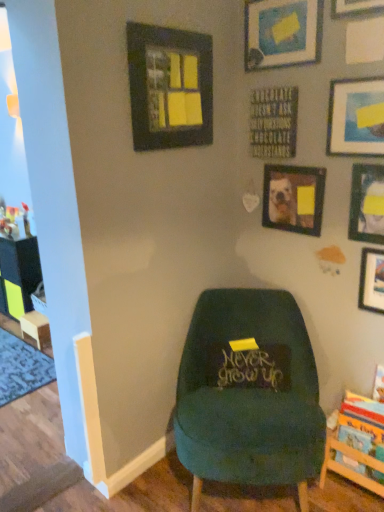
Describe the element at coordinates (282, 33) in the screenshot. This screenshot has width=384, height=512. I see `matte black picture frame at upper center, the second picture frame from the left` at that location.

The image size is (384, 512). What do you see at coordinates (293, 198) in the screenshot? I see `wooden picture frame at center, which is the fifth picture frame from right to left` at bounding box center [293, 198].

Locate an element on the screen. wooden at left is located at coordinates (35, 327).

The image size is (384, 512). What do you see at coordinates (169, 87) in the screenshot?
I see `matte black picture frame at upper left, which is counted as the 1th picture frame, starting from the left` at bounding box center [169, 87].

You are a GUI agent. You are given a task and a screenshot of the screen. Output one action in this format:
    pyautogui.click(x=<x>, y=<y>)
    Task: Click on the wooden bookshelf at lower right
    This screenshot has width=384, height=512.
    Given the screenshot: What is the action you would take?
    pyautogui.click(x=357, y=444)

Describe the element at coordinates (367, 204) in the screenshot. I see `matte black picture frame at upper right, the 2th picture frame in the right-to-left sequence` at that location.

The image size is (384, 512). Describe the element at coordinates (355, 7) in the screenshot. I see `wooden picture frame at upper right, the fourth picture frame when ordered from right to left` at that location.

At what (x,y) coordinates should I click in order to perform the action: click on matte black picture frame at upper center, the second picture frame from the left. Please return your answer as a coordinate pair (x, y). This screenshot has width=384, height=512. Looking at the image, I should click on (282, 33).

Looking at this image, is wooden at left facing towards velvet green chair at center?

No.

Is wooden at left not close to velvet green chair at center?

That's right, there is a large distance between wooden at left and velvet green chair at center.

How much distance is there between wooden at left and velvet green chair at center?

The distance of wooden at left from velvet green chair at center is 5.67 feet.

Which of these two, wooden at left or velvet green chair at center, stands shorter?

Standing shorter between the two is wooden at left.

Does matte blue picture frame at upper right, the 5th picture frame viewed from the left, lie behind wooden at left?

No, it is in front of wooden at left.

At what (x,y) coordinates should I click in order to perform the action: click on table below the matte blue picture frame at upper right, the 5th picture frame viewed from the left (from the image's perspective). Please return your answer as a coordinate pair (x, y). Image resolution: width=384 pixels, height=512 pixels. Looking at the image, I should click on (35, 327).

Can you tell me how much matte blue picture frame at upper right, the 5th picture frame viewed from the left, and wooden at left differ in facing direction?

The facing directions of matte blue picture frame at upper right, the 5th picture frame viewed from the left, and wooden at left are 0.902 degrees apart.

Considering the sizes of matte blue picture frame at upper right, the 5th picture frame viewed from the left, and wooden at left in the image, is matte blue picture frame at upper right, the 5th picture frame viewed from the left, wider or thinner than wooden at left?

matte blue picture frame at upper right, the 5th picture frame viewed from the left, is thinner than wooden at left.

Is matte black picture frame at upper center, the second picture frame from the left, looking in the opposite direction of wooden bookshelf at lower right?

matte black picture frame at upper center, the second picture frame from the left, is not turned away from wooden bookshelf at lower right.

From the image's perspective, is matte black picture frame at upper center, marked as the sixth picture frame in a right-to-left arrangement, located above or below wooden bookshelf at lower right?

From the image's perspective, matte black picture frame at upper center, marked as the sixth picture frame in a right-to-left arrangement, appears above wooden bookshelf at lower right.

From a real-world perspective, is matte black picture frame at upper center, marked as the sixth picture frame in a right-to-left arrangement, on wooden bookshelf at lower right?

Yes, from a real-world perspective, matte black picture frame at upper center, marked as the sixth picture frame in a right-to-left arrangement, is on top of wooden bookshelf at lower right.

Which of these two, matte black picture frame at upper center, the second picture frame from the left, or wooden bookshelf at lower right, is wider?

wooden bookshelf at lower right is wider.

Considering the positions of objects matte black picture frame at upper right, the 2th picture frame in the right-to-left sequence, and wooden bookshelf at lower right in the image provided, who is more to the left, matte black picture frame at upper right, the 2th picture frame in the right-to-left sequence, or wooden bookshelf at lower right?

wooden bookshelf at lower right is more to the left.

Who is smaller, matte black picture frame at upper right, the 6th picture frame in the left-to-right sequence, or wooden bookshelf at lower right?

matte black picture frame at upper right, the 6th picture frame in the left-to-right sequence.

Between matte black picture frame at upper right, the 2th picture frame in the right-to-left sequence, and wooden bookshelf at lower right, which one has more height?

With more height is wooden bookshelf at lower right.

Based on the photo, does matte black picture frame at upper right, the 6th picture frame in the left-to-right sequence, have a lesser width compared to matte black picture frame at upper center, marked as the sixth picture frame in a right-to-left arrangement?

Yes, matte black picture frame at upper right, the 6th picture frame in the left-to-right sequence, is thinner than matte black picture frame at upper center, marked as the sixth picture frame in a right-to-left arrangement.

Is matte black picture frame at upper right, the 2th picture frame in the right-to-left sequence, behind matte black picture frame at upper center, the second picture frame from the left?

No.

Is matte black picture frame at upper right, the 2th picture frame in the right-to-left sequence, completely or partially outside of matte black picture frame at upper center, marked as the sixth picture frame in a right-to-left arrangement?

Indeed, matte black picture frame at upper right, the 2th picture frame in the right-to-left sequence, is completely outside matte black picture frame at upper center, marked as the sixth picture frame in a right-to-left arrangement.

Which object is wider, wooden at left or wooden picture frame at upper right, the fourth picture frame when ordered from right to left?

wooden at left.

From the image's perspective, is wooden at left located above wooden picture frame at upper right, the fourth picture frame when ordered from right to left?

Incorrect, from the image's perspective, wooden at left is lower than wooden picture frame at upper right, the fourth picture frame when ordered from right to left.

Based on the photo, considering the sizes of objects wooden at left and wooden picture frame at upper right, the fourth picture frame when ordered from right to left, in the image provided, who is shorter, wooden at left or wooden picture frame at upper right, the fourth picture frame when ordered from right to left,?

wooden at left.

From a real-world perspective, is wooden at left physically below wooden picture frame at upper right, the fourth picture frame when ordered from right to left?

Yes, from a real-world perspective, wooden at left is below wooden picture frame at upper right, the fourth picture frame when ordered from right to left.

Which is behind, point (285, 186) or point (187, 142)?

The point (285, 186) is more distant.

Is wooden picture frame at center, which is the fifth picture frame from right to left, bigger or smaller than matte black picture frame at upper left, which is counted as the 1th picture frame, starting from the left?

Considering their sizes, wooden picture frame at center, which is the fifth picture frame from right to left, takes up less space than matte black picture frame at upper left, which is counted as the 1th picture frame, starting from the left.

This screenshot has height=512, width=384. I want to click on the 4th picture frame in front of the wooden picture frame at center, the 3th picture frame when ordered from left to right, starting your count from the anchor, so click(169, 87).

In the scene shown: From a real-world perspective, is wooden picture frame at center, which is the fifth picture frame from right to left, positioned above or below matte black picture frame at upper left, the 7th picture frame viewed from the right?

In terms of real-world spatial position, wooden picture frame at center, which is the fifth picture frame from right to left, is below matte black picture frame at upper left, the 7th picture frame viewed from the right.

In order to click on table that is on the left side of velvet green chair at center in this screenshot , I will do `click(35, 327)`.

Locate an element on the screen. This screenshot has width=384, height=512. the 6th picture frame in front of the wooden at left, counting from the anchor's position is located at coordinates (356, 117).

From the image, which object appears to be nearer to matte white picture frame at upper right, the first picture frame from the right, velvet green chair at center or matte black sign at center?

matte black sign at center.

When comparing their distances from wooden bookshelf at lower right, does matte white picture frame at upper right, the first picture frame from the right, or matte black picture frame at upper right, the 2th picture frame in the right-to-left sequence, seem closer?

Based on the image, matte white picture frame at upper right, the first picture frame from the right, appears to be nearer to wooden bookshelf at lower right.

From the image, which object appears to be nearer to wooden bookshelf at lower right, matte black picture frame at upper left, which is counted as the 1th picture frame, starting from the left, or wooden picture frame at center, which is the fifth picture frame from right to left?

Among the two, wooden picture frame at center, which is the fifth picture frame from right to left, is located nearer to wooden bookshelf at lower right.

Based on their spatial positions, is matte black sign at center or wooden at left closer to matte black picture frame at upper center, marked as the sixth picture frame in a right-to-left arrangement?

matte black sign at center.

Looking at the image, which one is located closer to velvet green chair at center, matte black sign at center or matte black picture frame at upper right, the 6th picture frame in the left-to-right sequence?

Based on the image, matte black sign at center appears to be nearer to velvet green chair at center.

Considering their positions, is matte blue picture frame at upper right, the 5th picture frame viewed from the left, positioned closer to wooden picture frame at center, which is the fifth picture frame from right to left, than wooden at left?

matte blue picture frame at upper right, the 5th picture frame viewed from the left, is positioned closer to the anchor wooden picture frame at center, which is the fifth picture frame from right to left.

Considering their positions, is matte black picture frame at upper center, marked as the sixth picture frame in a right-to-left arrangement, positioned further to velvet green chair at center than wooden picture frame at center, the 3th picture frame when ordered from left to right?

matte black picture frame at upper center, marked as the sixth picture frame in a right-to-left arrangement, is further to velvet green chair at center.

Which object lies nearer to the anchor point velvet green chair at center, matte black picture frame at upper right, the 2th picture frame in the right-to-left sequence, or wooden picture frame at center, which is the fifth picture frame from right to left?

wooden picture frame at center, which is the fifth picture frame from right to left, lies closer to velvet green chair at center than the other object.

This screenshot has height=512, width=384. I want to click on shelf located between wooden at left and matte white picture frame at upper right, the first picture frame from the right, in the left-right direction, so click(x=357, y=444).

Where is `writing between wooden at left and matte blue picture frame at upper right, the 5th picture frame viewed from the left`? writing between wooden at left and matte blue picture frame at upper right, the 5th picture frame viewed from the left is located at coordinates (248, 368).

In order to click on chair situated between wooden at left and matte white picture frame at upper right, the first picture frame from the right, from left to right in this screenshot , I will do `click(249, 393)`.

The width and height of the screenshot is (384, 512). What are the coordinates of `writing between matte black picture frame at upper right, the 6th picture frame in the left-to-right sequence, and wooden bookshelf at lower right, in the vertical direction` in the screenshot? It's located at (248, 368).